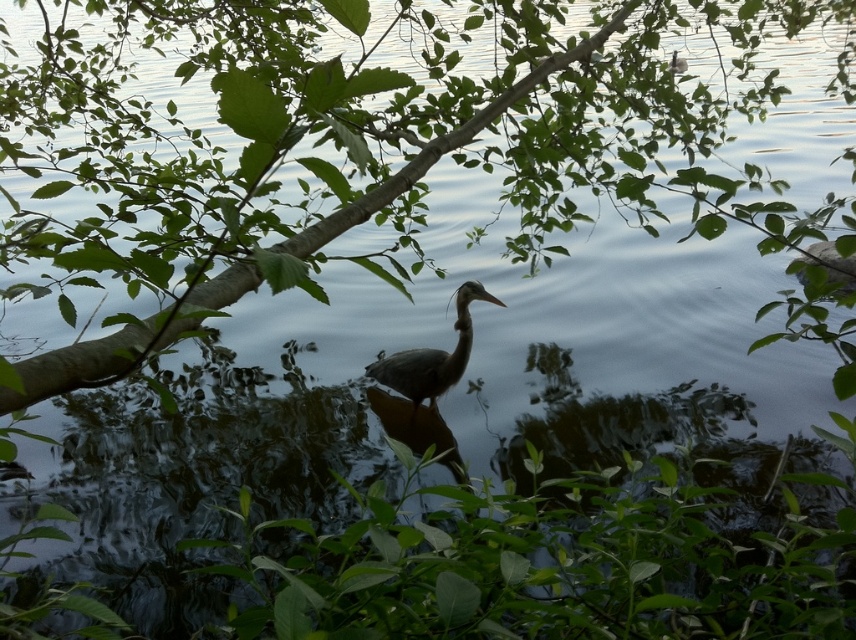
Is green leafy plant at lower center bigger than gray matte heron at center?

Yes.

Is green leafy plant at lower center positioned at the back of gray matte heron at center?

That is False.

Does point (318, 602) come closer to viewer compared to point (440, 378)?

Yes, it is.

Where is `green leafy plant at lower center`? The image size is (856, 640). green leafy plant at lower center is located at coordinates pyautogui.click(x=545, y=566).